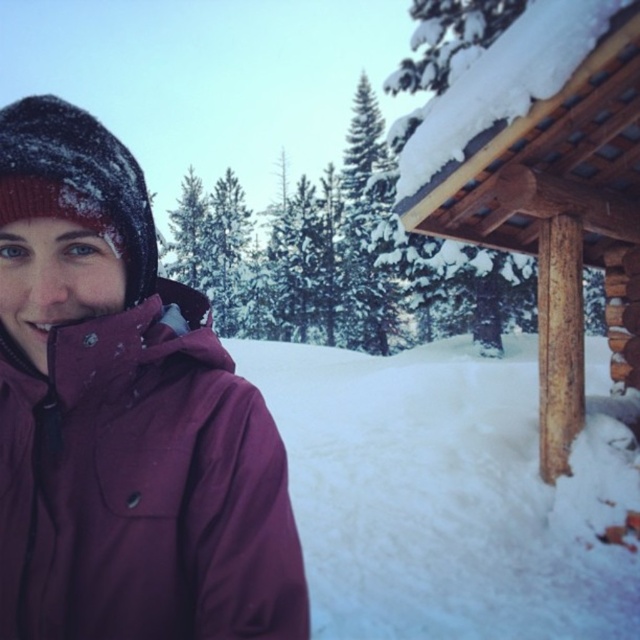
Question: Is white fluffy snow at lower center thinner than matte purple jacket at left?

Choices:
 (A) no
 (B) yes

Answer: (A)

Question: Among these objects, which one is nearest to the camera?

Choices:
 (A) matte purple jacket at left
 (B) satin-like dark brown hat at left
 (C) white fluffy snow at lower center
 (D) wooden cabin at right

Answer: (B)

Question: Which point is closer to the camera?

Choices:
 (A) wooden cabin at right
 (B) matte purple jacket at left
 (C) white fluffy snow at lower center

Answer: (B)

Question: Which of the following is the farthest from the observer?

Choices:
 (A) (376, 442)
 (B) (609, 152)
 (C) (154, 504)

Answer: (A)

Question: Can you confirm if white fluffy snow at lower center is positioned to the left of matte purple jacket at left?

Choices:
 (A) yes
 (B) no

Answer: (B)

Question: Observing the image, what is the correct spatial positioning of wooden cabin at right in reference to satin-like dark brown hat at left?

Choices:
 (A) left
 (B) right

Answer: (B)